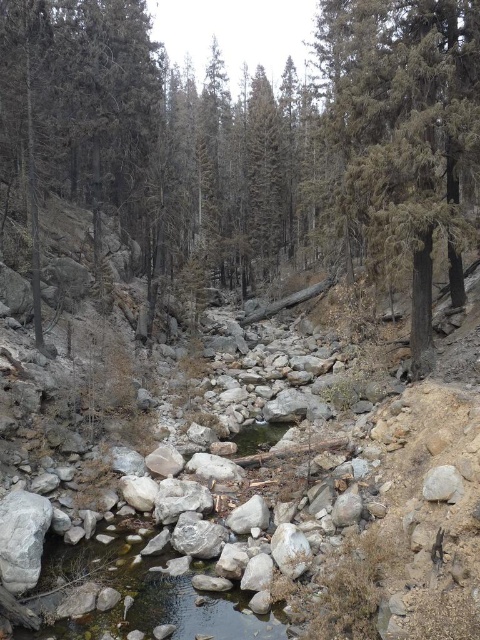
Is charred bark tree at center positioned at the back of clear water at center?

No, it is not.

Between point (439, 97) and point (250, 449), which one is positioned behind?

Point (250, 449)

What do you see at coordinates (405, 132) in the screenshot?
I see `charred bark tree at center` at bounding box center [405, 132].

Locate an element on the screen. This screenshot has height=640, width=480. charred bark tree at center is located at coordinates (405, 132).

Does charred wood tree at center appear under clear water at center?

No.

Can you confirm if charred wood tree at center is bigger than clear water at center?

Indeed, charred wood tree at center has a larger size compared to clear water at center.

Where is `charred wood tree at center`? The height and width of the screenshot is (640, 480). charred wood tree at center is located at coordinates (252, 140).

Which is above, gray rock stream at center or clear water at center?

clear water at center

Between point (128, 593) and point (242, 436), which one is positioned in front?

Point (128, 593)

I want to click on gray rock stream at center, so click(x=148, y=596).